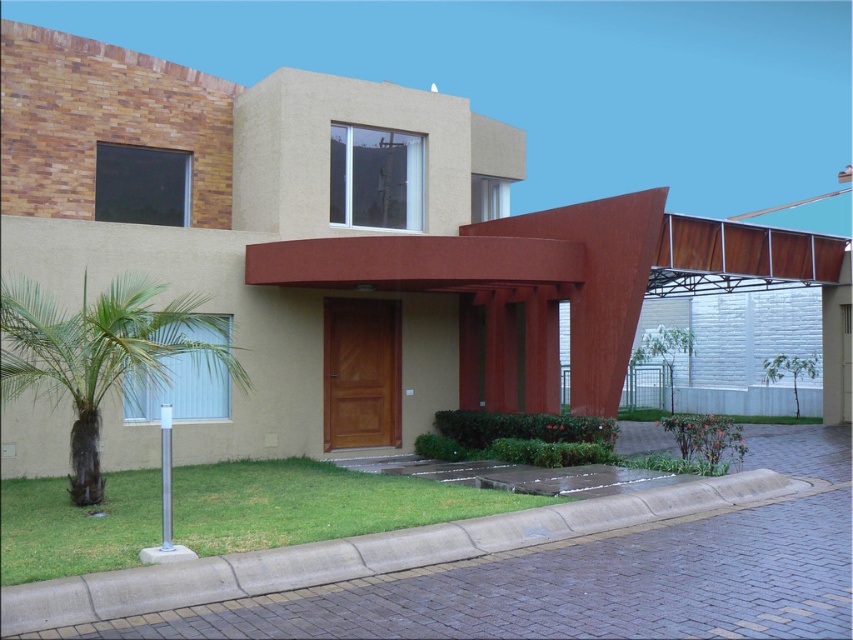
You are standing in front of the residential building and want to walk towards the entrance. Which object, the green grass at lower center or the gray concrete curb at lower center, is closer to you as you approach the entrance?

The green grass at lower center is closer to you because it is further to the viewer than the gray concrete curb at lower center, meaning it appears nearer in the image.

You are a landscape architect designing a pathway that needs to curve around the green leafy palm tree at lower left and the gray concrete curb at lower center. Based on their positions, which object should the pathway first go around?

The pathway should first go around the green leafy palm tree at lower left because the gray concrete curb at lower center is positioned to the right of it, meaning the palm tree is on the left side and should be encountered first when approaching from the lower left.

You are standing at the entrance of the residential building and want to know how far you are from the point marked at coordinates point (241, 531). Can you determine the distance?

The distance between you and the point (241, 531) is 7.55 meters.